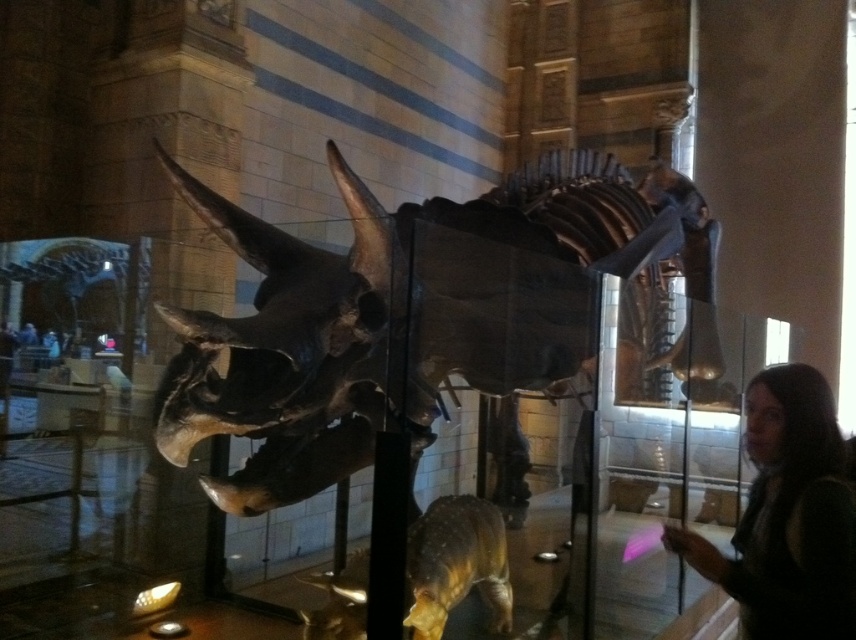
Question: Which of the following is the closest to the observer?

Choices:
 (A) (316, 362)
 (B) (789, 595)

Answer: (B)

Question: Is shiny metallic dinosaur skeleton at center below dark brown hair at lower right?

Choices:
 (A) no
 (B) yes

Answer: (A)

Question: Can you confirm if shiny metallic dinosaur skeleton at center is bigger than dark brown hair at lower right?

Choices:
 (A) no
 (B) yes

Answer: (B)

Question: Can you confirm if shiny metallic dinosaur skeleton at center is positioned above dark brown hair at lower right?

Choices:
 (A) yes
 (B) no

Answer: (A)